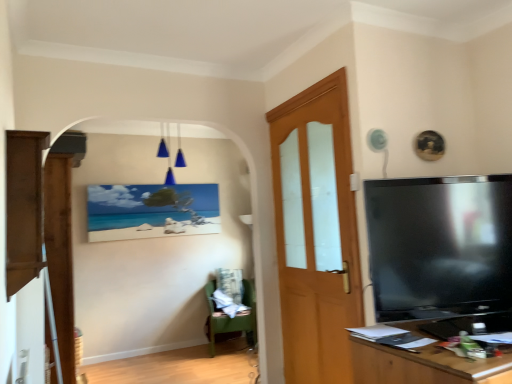
Question: Based on their positions, is wooden desk at right located to the left or right of matte canvas painting at center?

Choices:
 (A) right
 (B) left

Answer: (A)

Question: From their relative heights in the image, would you say wooden desk at right is taller or shorter than matte canvas painting at center?

Choices:
 (A) tall
 (B) short

Answer: (B)

Question: Estimate the real-world distances between objects in this image. Which object is closer to the matte canvas painting at center?

Choices:
 (A) black glossy tv at right
 (B) wooden desk at right
 (C) brown wood cabinet at left
 (D) wooden door at center
 (E) green fabric chair at lower left

Answer: (E)

Question: Which object is the farthest from the matte canvas painting at center?

Choices:
 (A) blue glass light fixture at upper center
 (B) wooden door at center
 (C) black glossy tv at right
 (D) green fabric chair at lower left
 (E) wooden desk at right

Answer: (E)